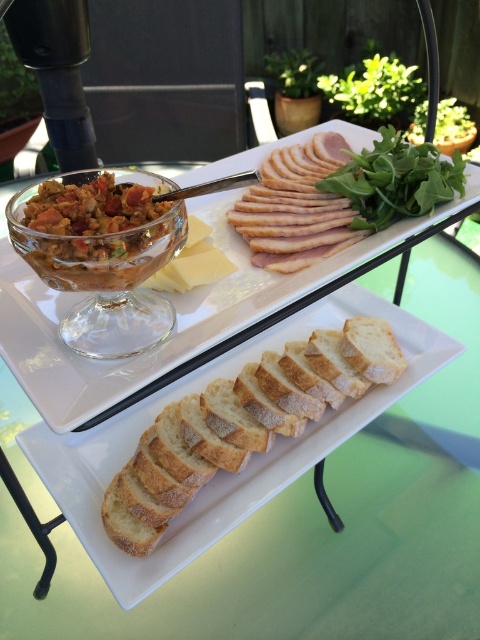
You are a guest at this outdoor meal setup and want to reach for the golden brown crusty bread at center. However, there is another bread piece at golden brown crusty bread at lower center in your way. Which bread should you move first to access the one above?

You should move the golden brown crusty bread at lower center first because the golden brown crusty bread at center is located above it, so removing the lower one will allow access to the one above.

You are standing at the point with coordinates point (87, 236) and want to look at the point with coordinates point (381, 404). Will you need to move forward or backward to see it better?

Point (381, 404) is behind point (87, 236), so you will need to move forward to see it better.